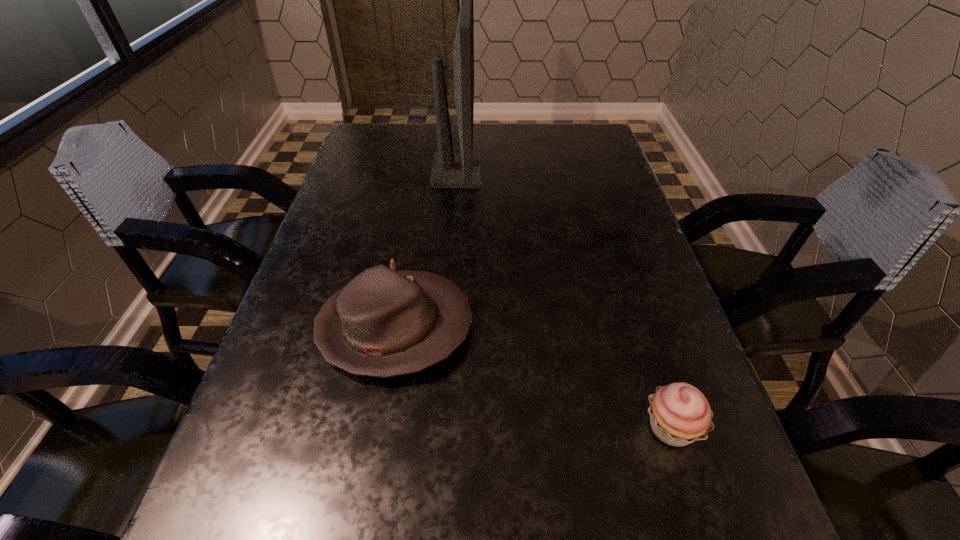
Image resolution: width=960 pixels, height=540 pixels. In order to click on vacant area that lies between the cupcake and the farthest object in this screenshot , I will do `click(564, 300)`.

Locate an element on the screen. This screenshot has width=960, height=540. vacant space that is in between the cupcake and the second farthest object is located at coordinates (533, 377).

At what (x,y) coordinates should I click in order to perform the action: click on vacant space that's between the rightmost object and the hat. Please return your answer as a coordinate pair (x, y). Image resolution: width=960 pixels, height=540 pixels. Looking at the image, I should click on (533, 377).

Locate an element on the screen. Image resolution: width=960 pixels, height=540 pixels. free area in between the rightmost object and the second nearest object is located at coordinates (533, 377).

Where is `free area in between the hat and the cupcake`? free area in between the hat and the cupcake is located at coordinates (533, 377).

Identify which object is the second nearest to the cupcake. Please provide its 2D coordinates. Your answer should be formatted as a tuple, i.e. [(x, y)], where the tuple contains the x and y coordinates of a point satisfying the conditions above.

[(449, 170)]

Identify which object is located as the nearest to the computer monitor. Please provide its 2D coordinates. Your answer should be formatted as a tuple, i.e. [(x, y)], where the tuple contains the x and y coordinates of a point satisfying the conditions above.

[(383, 323)]

You are a GUI agent. You are given a task and a screenshot of the screen. Output one action in this format:
    pyautogui.click(x=<x>, y=<y>)
    Task: Click on the free space that satisfies the following two spatial constraints: 1. on the back side of the rightmost object; 2. on the front-facing side of the tallest object
    
    Given the screenshot: What is the action you would take?
    pyautogui.click(x=588, y=173)

In order to click on vacant space that satisfies the following two spatial constraints: 1. on the front-facing side of the nearest object; 2. on the left side of the farthest object in this screenshot , I will do `click(439, 428)`.

Find the location of `vacant position in the image that satisfies the following two spatial constraints: 1. on the decorative side of the hat; 2. on the right side of the cupcake`. vacant position in the image that satisfies the following two spatial constraints: 1. on the decorative side of the hat; 2. on the right side of the cupcake is located at coordinates [378, 428].